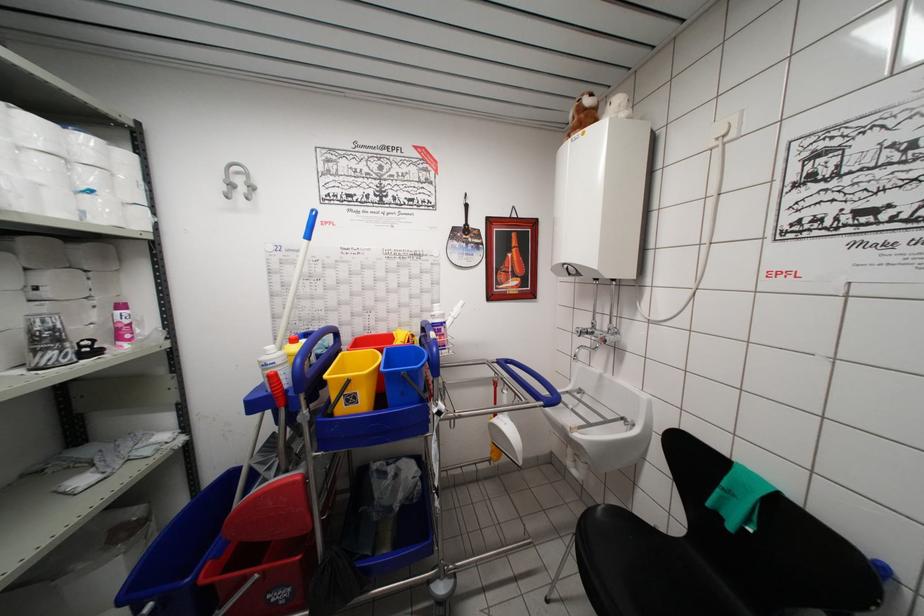
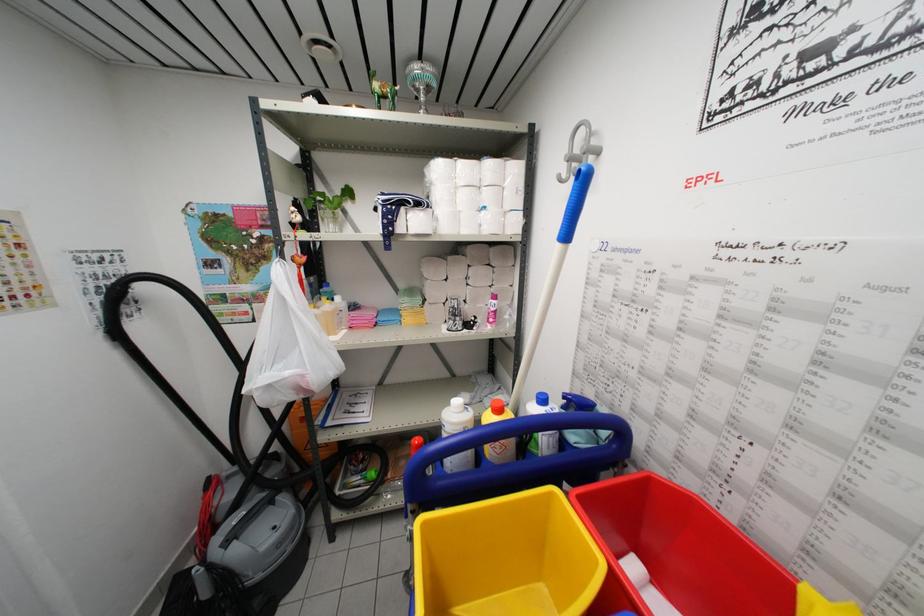
In the second image, find the point that corresponds to point (346, 360) in the first image.

(554, 498)